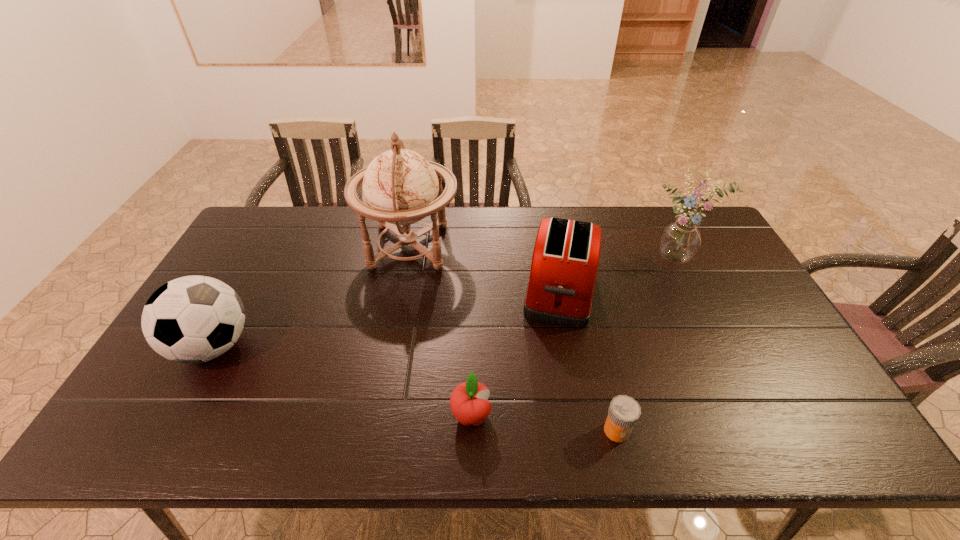
This screenshot has width=960, height=540. I want to click on vacant area that satisfies the following two spatial constraints: 1. on the back side of the second shortest object; 2. at the front of the tallest object showing Africa, so click(474, 246).